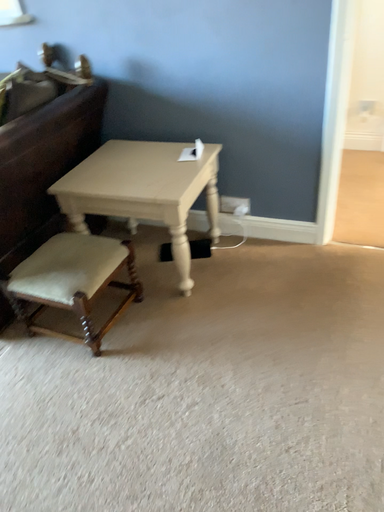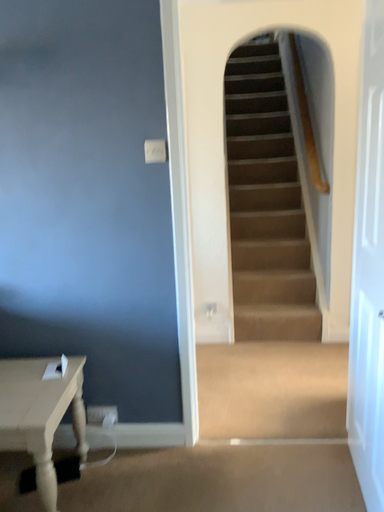
Question: Which way did the camera rotate in the video?

Choices:
 (A) rotated upward
 (B) rotated downward

Answer: (A)